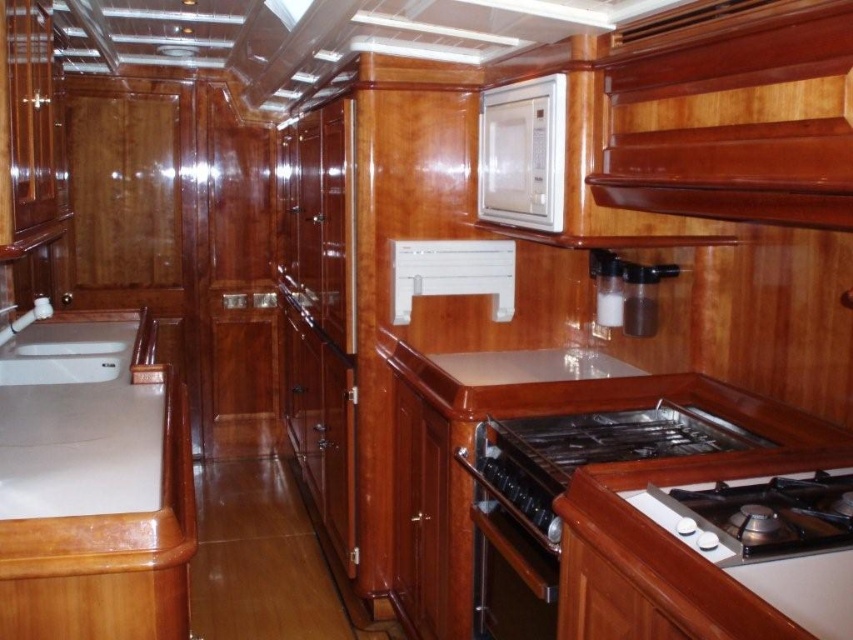
Question: Is black polished metal gas stove at lower right thinner than white glossy gas stove at lower right?

Choices:
 (A) yes
 (B) no

Answer: (B)

Question: Can you confirm if satin silver oven at center is positioned to the left of white glossy sink at lower left?

Choices:
 (A) no
 (B) yes

Answer: (A)

Question: Does black polished metal gas stove at lower right come behind satin silver oven at center?

Choices:
 (A) no
 (B) yes

Answer: (B)

Question: Which object appears farthest from the camera in this image?

Choices:
 (A) satin silver oven at center
 (B) white glossy sink at lower left
 (C) white glossy gas stove at lower right
 (D) black polished metal gas stove at lower right

Answer: (B)

Question: Which of the following is the farthest from the observer?

Choices:
 (A) black polished metal gas stove at lower right
 (B) white glossy microwave at upper center

Answer: (B)

Question: Considering the real-world distances, which object is closest to the satin silver oven at center?

Choices:
 (A) black polished metal gas stove at lower right
 (B) white glossy microwave at upper center
 (C) white glossy gas stove at lower right

Answer: (A)